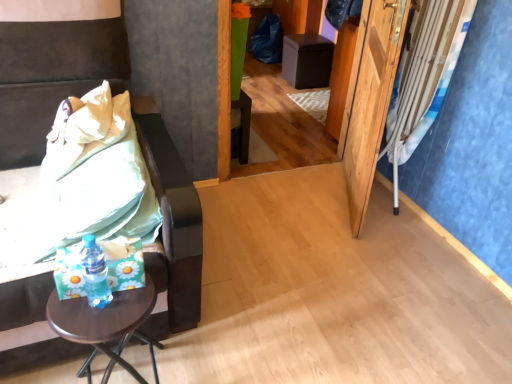
Locate an element on the screen. The image size is (512, 384). empty space that is ontop of brown wooden table at lower left (from a real-world perspective) is located at coordinates (112, 304).